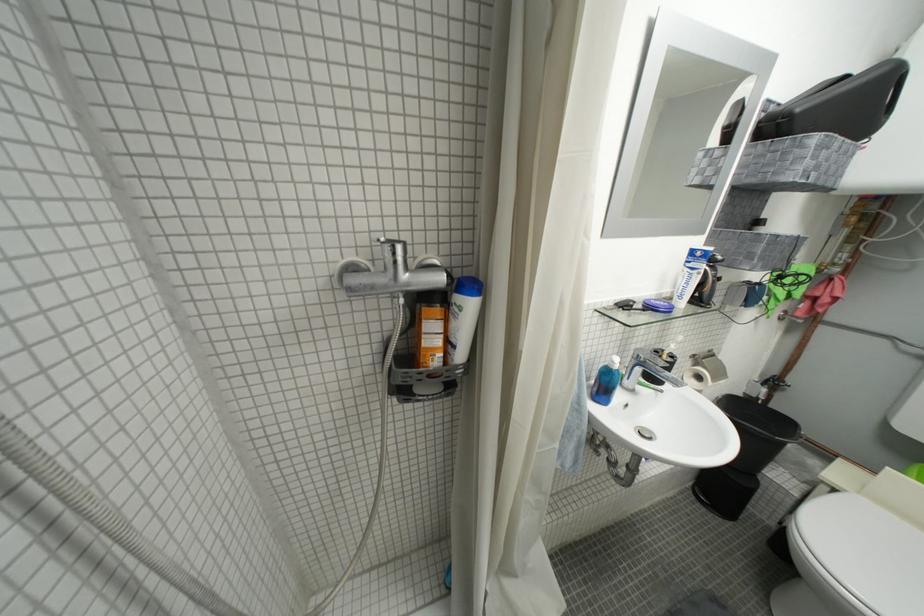
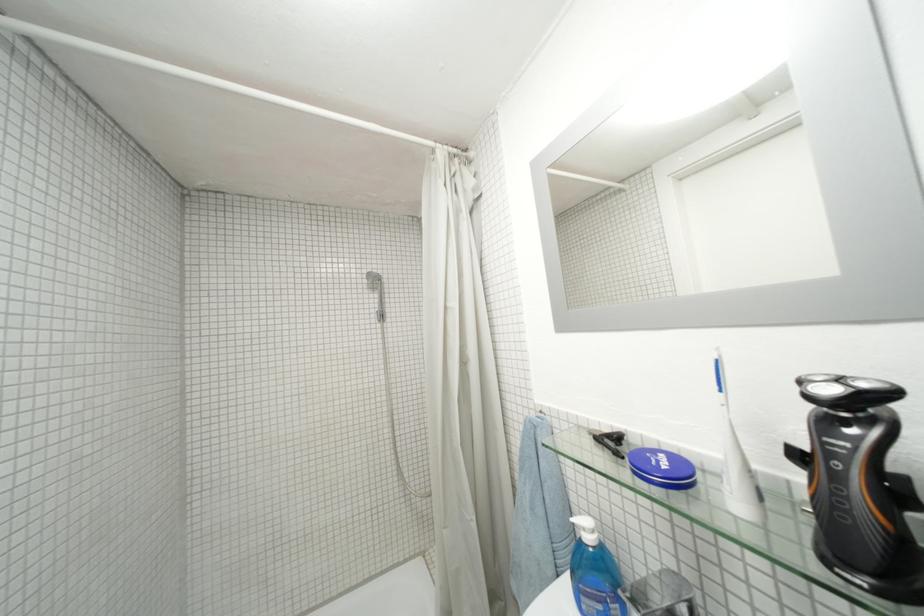
Find the pixel in the second image that matches the point at 626,369 in the first image.

(598, 541)